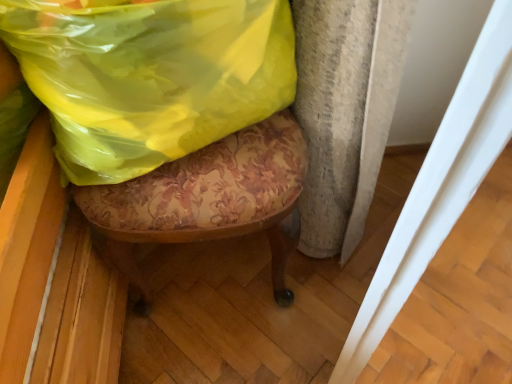
Question: Should I look upward or downward to see yellow plastic bag at upper center?

Choices:
 (A) up
 (B) down

Answer: (A)